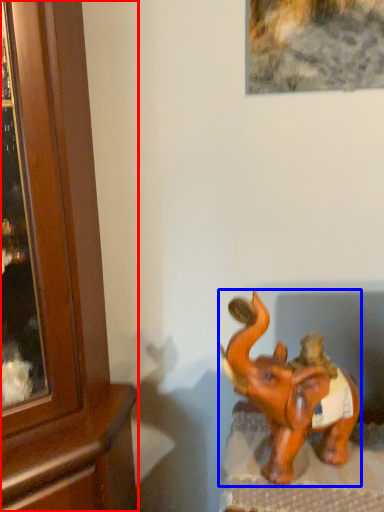
Question: Which object appears farthest to the camera in this image, cabinetry (highlighted by a red box) or elephant (highlighted by a blue box)?

Choices:
 (A) cabinetry
 (B) elephant

Answer: (B)